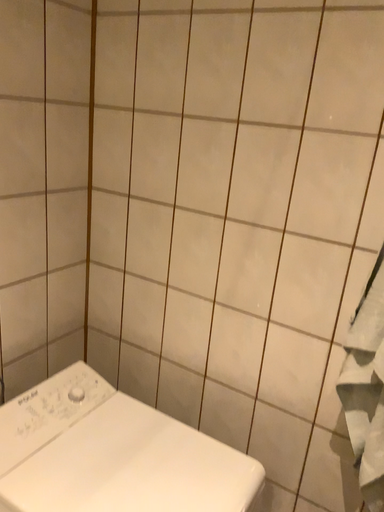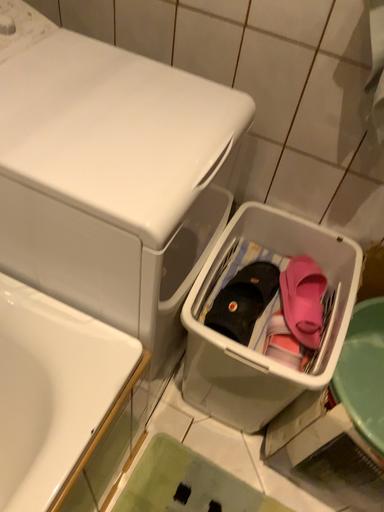
Question: How did the camera likely rotate when shooting the video?

Choices:
 (A) rotated downward
 (B) rotated upward

Answer: (A)